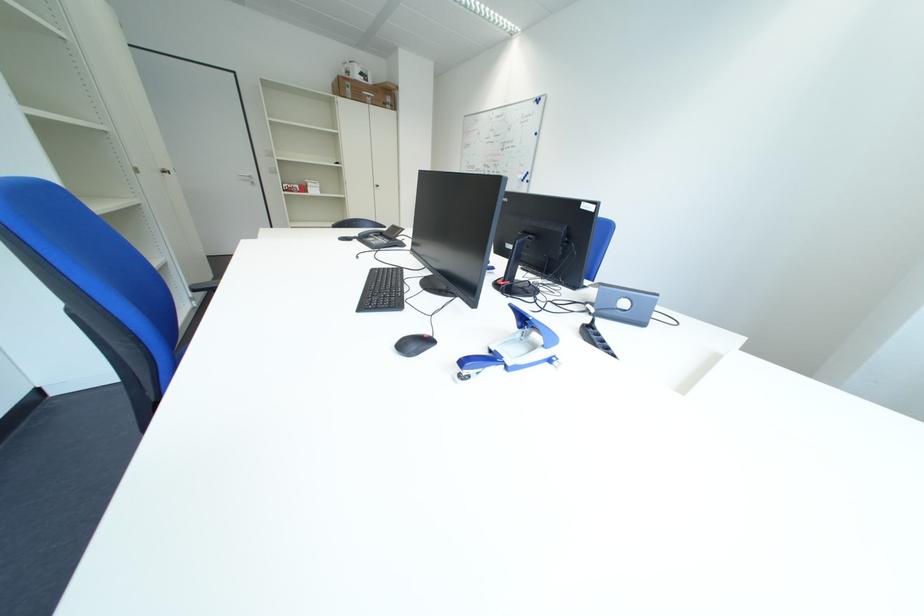
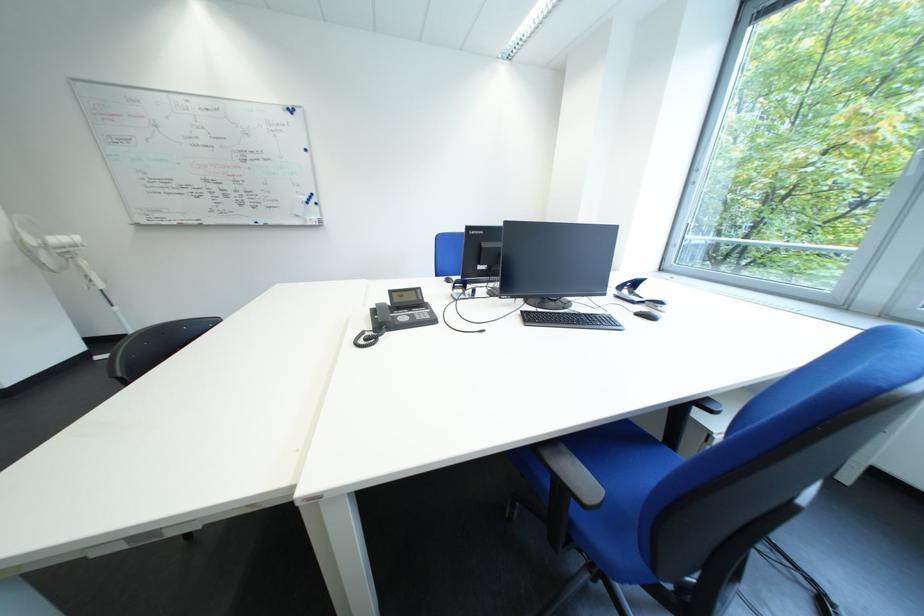
Find the pixel in the second image that matches pixel 383 241 in the first image.

(416, 320)